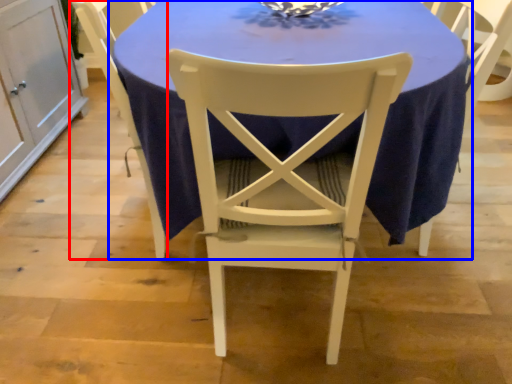
Question: Which point is further to the camera, chair (highlighted by a red box) or table (highlighted by a blue box)?

Choices:
 (A) chair
 (B) table

Answer: (A)